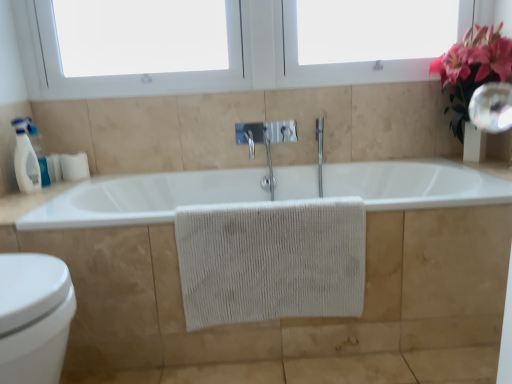
You are a GUI agent. You are given a task and a screenshot of the screen. Output one action in this format:
    pyautogui.click(x=<x>, y=<y>)
    Task: Click on the white plastic window screen at upper right, which appears as the first window screen when viewed from the right
    This screenshot has width=512, height=384.
    Given the screenshot: What is the action you would take?
    pyautogui.click(x=374, y=30)

What is the approximate height of pink silk flowers at upper right?

The height of pink silk flowers at upper right is 23.63 inches.

At what (x,y) coordinates should I click in order to perform the action: click on clear glass mirror at upper right. Please return your answer as a coordinate pair (x, y). Looking at the image, I should click on (492, 107).

What do you see at coordinates (140, 36) in the screenshot? This screenshot has width=512, height=384. I see `white plastic window at upper center, the first window screen when ordered from left to right` at bounding box center [140, 36].

Identify the location of white glossy bidet at lower left. The height and width of the screenshot is (384, 512). (34, 317).

Locate an element on the screen. white plastic window screen at upper right, which is counted as the second window screen, starting from the left is located at coordinates (374, 30).

Which object is closer to the camera taking this photo, white glossy counter top at lower left or white matte bathtub at center?

white matte bathtub at center is in front.

Considering the positions of objects white glossy counter top at lower left and white matte bathtub at center in the image provided, who is more to the right, white glossy counter top at lower left or white matte bathtub at center?

Positioned to the right is white matte bathtub at center.

Locate an element on the screen. Image resolution: width=512 pixels, height=384 pixels. bath in front of the white glossy counter top at lower left is located at coordinates (297, 318).

Can you tell me how much white glossy counter top at lower left and white matte bathtub at center differ in facing direction?

There is a 0.00131-degree angle between the facing directions of white glossy counter top at lower left and white matte bathtub at center.

Looking at this image, are pink silk flowers at upper right and white glossy bottle at left making contact?

No, pink silk flowers at upper right is not with white glossy bottle at left.

From the image's perspective, between pink silk flowers at upper right and white glossy bottle at left, who is located below?

white glossy bottle at left.

Considering the positions of objects pink silk flowers at upper right and white glossy bottle at left in the image provided, who is more to the left, pink silk flowers at upper right or white glossy bottle at left?

white glossy bottle at left is more to the left.

Can you confirm if pink silk flowers at upper right is taller than white glossy bottle at left?

Correct, pink silk flowers at upper right is much taller as white glossy bottle at left.

Which of these two, white glossy bottle at left or pink silk flowers at upper right, stands taller?

pink silk flowers at upper right is taller.

In the scene shown: Which is closer to the camera, (20, 125) or (469, 35)?

Point (20, 125).

Which of these two, pink silk flowers at upper right or white glossy counter top at lower left, is bigger?

pink silk flowers at upper right.

Which is more distant, (460,78) or (2,213)?

The point (460,78) is more distant.

Based on the photo, considering the sizes of objects pink silk flowers at upper right and white glossy counter top at lower left in the image provided, who is shorter, pink silk flowers at upper right or white glossy counter top at lower left?

Standing shorter between the two is white glossy counter top at lower left.

Is pink silk flowers at upper right not within white glossy counter top at lower left?

Yes, pink silk flowers at upper right is outside of white glossy counter top at lower left.

Considering the relative sizes of white glossy bidet at lower left and beige textured towel at center in the image provided, is white glossy bidet at lower left smaller than beige textured towel at center?

No.

Considering the relative sizes of white glossy bidet at lower left and beige textured towel at center in the image provided, is white glossy bidet at lower left thinner than beige textured towel at center?

No, white glossy bidet at lower left is not thinner than beige textured towel at center.

In the scene shown: Is there a large distance between white glossy bidet at lower left and beige textured towel at center?

No, white glossy bidet at lower left is not far away from beige textured towel at center.

How much distance is there between white glossy bidet at lower left and beige textured towel at center?

white glossy bidet at lower left and beige textured towel at center are 22.49 inches apart from each other.

Is white glossy bottle at left located outside white plastic window at upper center, which is the second window screen in right-to-left order?

white glossy bottle at left lies outside white plastic window at upper center, which is the second window screen in right-to-left order,'s area.

What's the angular difference between white glossy bottle at left and white plastic window at upper center, the first window screen when ordered from left to right,'s facing directions?

white glossy bottle at left and white plastic window at upper center, the first window screen when ordered from left to right, are facing 88.2 degrees away from each other.

From the image's perspective, who appears lower, white glossy bottle at left or white plastic window at upper center, which is the second window screen in right-to-left order?

white glossy bottle at left is shown below in the image.

Would you consider white glossy bottle at left to be distant from white plastic window at upper center, which is the second window screen in right-to-left order?

No, white glossy bottle at left is not far away from white plastic window at upper center, which is the second window screen in right-to-left order.

Visually, is white plastic window screen at upper right, which is counted as the second window screen, starting from the left, positioned to the left or to the right of beige textured towel at center?

In the image, white plastic window screen at upper right, which is counted as the second window screen, starting from the left, appears on the right side of beige textured towel at center.

From a real-world perspective, who is located lower, white plastic window screen at upper right, which is counted as the second window screen, starting from the left, or beige textured towel at center?

beige textured towel at center is physically lower.

Which point is more distant from viewer, (453, 33) or (178, 225)?

The point (453, 33) is behind.

There is a white matte bathtub at center. In order to click on counter top above it (from a real-world perspective) in this screenshot , I will do (29, 201).

Locate an element on the screen. cleaning product behind the pink silk flowers at upper right is located at coordinates (25, 158).

When comparing their distances from beige textured towel at center, does white glossy bidet at lower left or pink silk flowers at upper right seem closer?

white glossy bidet at lower left lies closer to beige textured towel at center than the other object.

Considering their positions, is white glossy bottle at left positioned closer to white plastic window at upper center, which is the second window screen in right-to-left order, than pink silk flowers at upper right?

Among the two, white glossy bottle at left is located nearer to white plastic window at upper center, which is the second window screen in right-to-left order.

Which object lies further to the anchor point white glossy bottle at left, beige textured towel at center or white glossy bidet at lower left?

beige textured towel at center is positioned further to the anchor white glossy bottle at left.

Considering their positions, is white matte bathtub at center positioned closer to white glossy counter top at lower left than white glossy bottle at left?

white glossy bottle at left is closer to white glossy counter top at lower left.

Considering their positions, is white plastic window screen at upper right, which is counted as the second window screen, starting from the left, positioned further to pink silk flowers at upper right than white matte bathtub at center?

white matte bathtub at center.

Based on their spatial positions, is clear glass mirror at upper right or white plastic window at upper center, which is the second window screen in right-to-left order, further from white matte bathtub at center?

Among the two, white plastic window at upper center, which is the second window screen in right-to-left order, is located further to white matte bathtub at center.

From the picture: When comparing their distances from clear glass mirror at upper right, does white glossy bottle at left or white plastic window at upper center, the first window screen when ordered from left to right, seem further?

white glossy bottle at left lies further to clear glass mirror at upper right than the other object.

Consider the image. When comparing their distances from white glossy bottle at left, does white matte toilet paper at left or pink silk flowers at upper right seem further?

pink silk flowers at upper right lies further to white glossy bottle at left than the other object.

Where is `floral arrangement between white plastic window screen at upper right, which is counted as the second window screen, starting from the left, and beige textured towel at center vertically`? The image size is (512, 384). floral arrangement between white plastic window screen at upper right, which is counted as the second window screen, starting from the left, and beige textured towel at center vertically is located at coordinates (472, 69).

Where is `bidet between white matte toilet paper at left and pink silk flowers at upper right`? The height and width of the screenshot is (384, 512). bidet between white matte toilet paper at left and pink silk flowers at upper right is located at coordinates (34, 317).

Locate an element on the screen. Image resolution: width=512 pixels, height=384 pixels. cleaning product positioned between white glossy bidet at lower left and white plastic window at upper center, which is the second window screen in right-to-left order, from near to far is located at coordinates (25, 158).

The width and height of the screenshot is (512, 384). In order to click on bath located between white glossy bottle at left and clear glass mirror at upper right in the left-right direction in this screenshot , I will do `click(297, 318)`.